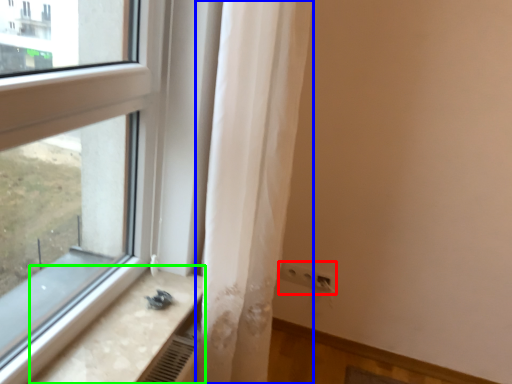
Question: Which object is the closest to the electric outlet (highlighted by a red box)? Choose among these: curtain (highlighted by a blue box) or counter top (highlighted by a green box).

Choices:
 (A) curtain
 (B) counter top

Answer: (A)